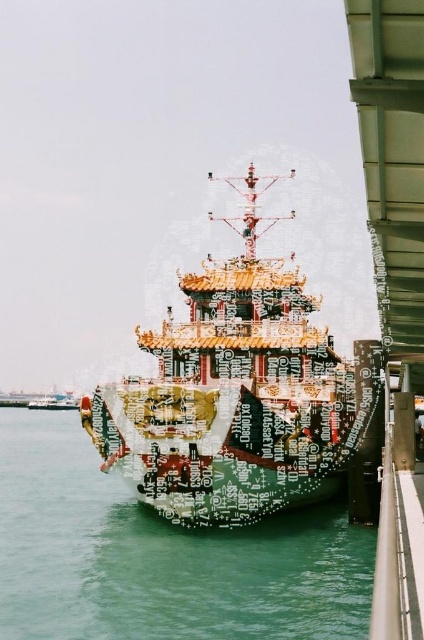
Which of these two, green glossy water at center or gold lacquered ship at center, stands shorter?

With less height is green glossy water at center.

You are a GUI agent. You are given a task and a screenshot of the screen. Output one action in this format:
    pyautogui.click(x=<x>, y=<y>)
    Task: Click on the green glossy water at center
    The image size is (424, 640).
    Given the screenshot: What is the action you would take?
    click(159, 556)